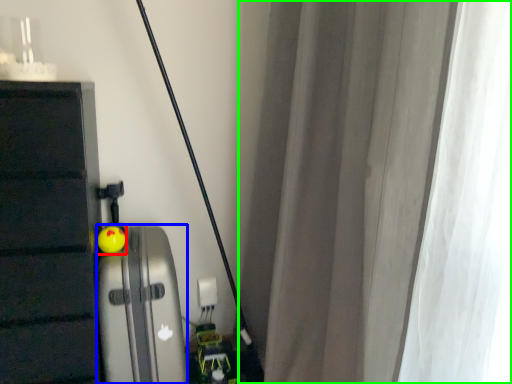
Question: Considering the real-world distances, which object is farthest from toy (highlighted by a red box)? appliance (highlighted by a blue box) or curtain (highlighted by a green box)?

Choices:
 (A) appliance
 (B) curtain

Answer: (B)